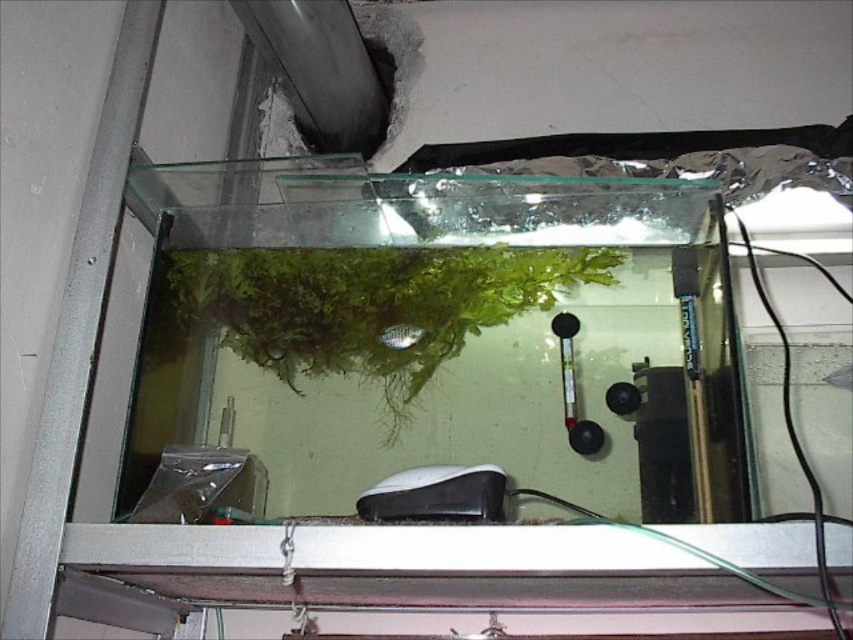
Question: Considering the relative positions of green matte plant at center and green matte fish at center in the image provided, where is green matte plant at center located with respect to green matte fish at center?

Choices:
 (A) left
 (B) right

Answer: (B)

Question: Based on their relative distances, which object is farther from the green matte plant at center?

Choices:
 (A) white matte air pump at bottom
 (B) green matte fish at center

Answer: (A)

Question: Which point is farther to the camera?

Choices:
 (A) white matte air pump at bottom
 (B) green matte plant at center

Answer: (B)

Question: Is green matte plant at center in front of green matte fish at center?

Choices:
 (A) yes
 (B) no

Answer: (A)

Question: Which of the following is the closest to the observer?

Choices:
 (A) (474, 512)
 (B) (335, 316)
 (C) (399, 326)

Answer: (A)

Question: Is green matte plant at center to the left of white matte air pump at bottom from the viewer's perspective?

Choices:
 (A) yes
 (B) no

Answer: (A)